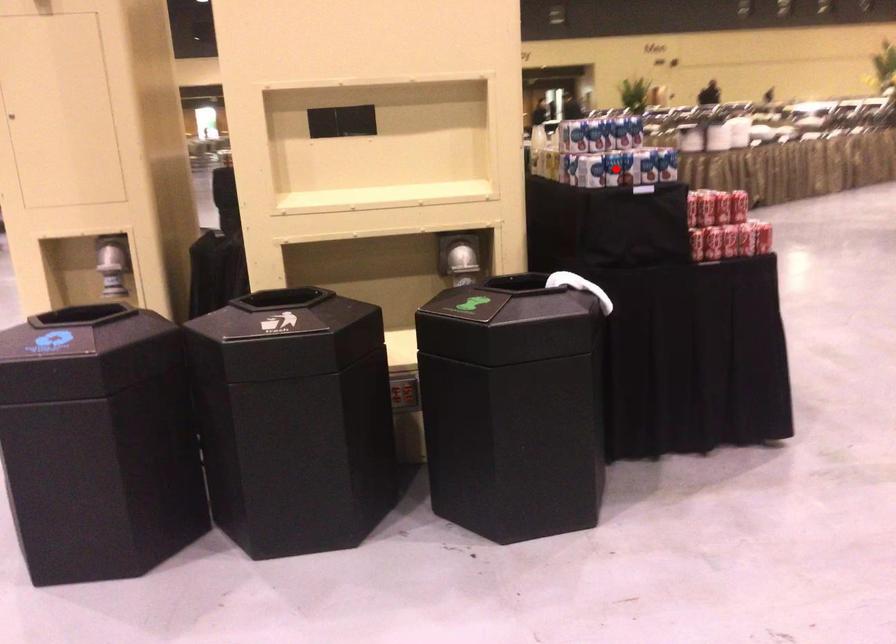
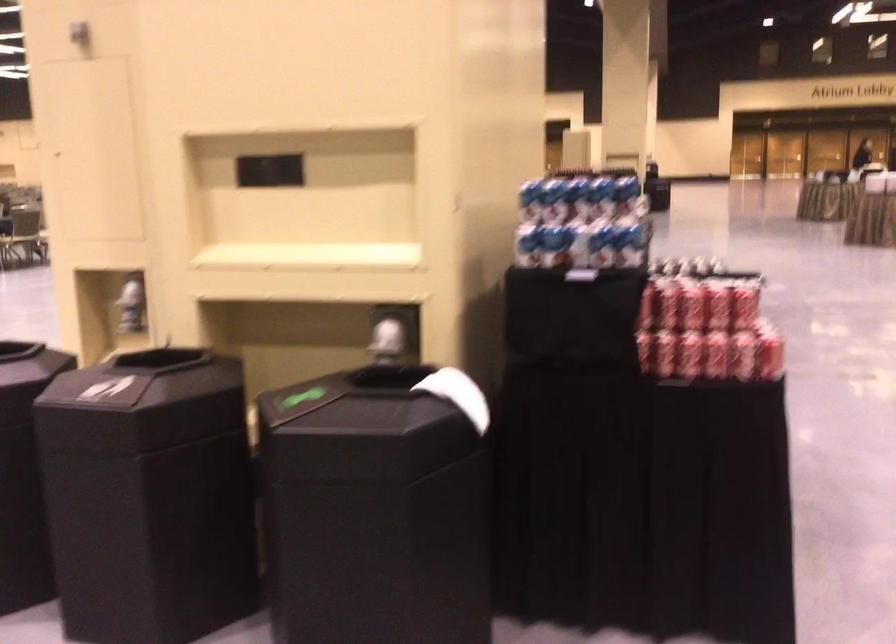
Question: I am providing you with two images of the same scene from different viewpoints. A red point is marked on the first image. At the location where the point appears in image 1, is it still visible in image 2?

Choices:
 (A) Yes
 (B) No

Answer: (A)